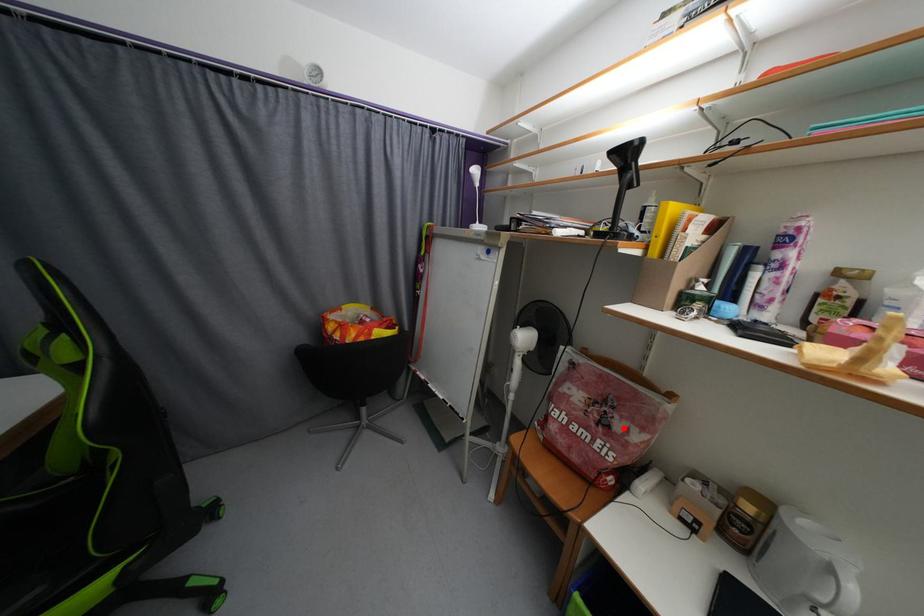
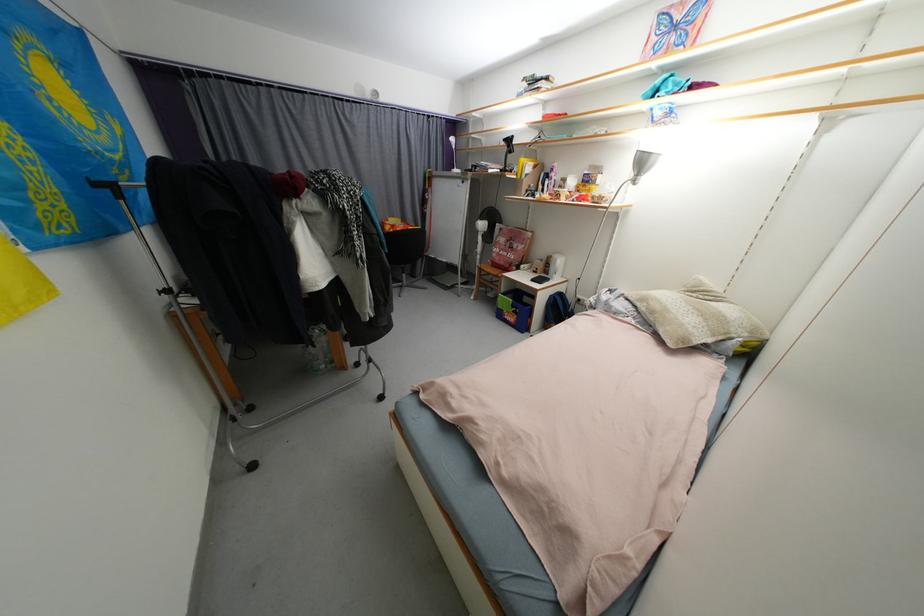
In the second image, find the point that corresponds to the highlighted location in the first image.

(520, 248)